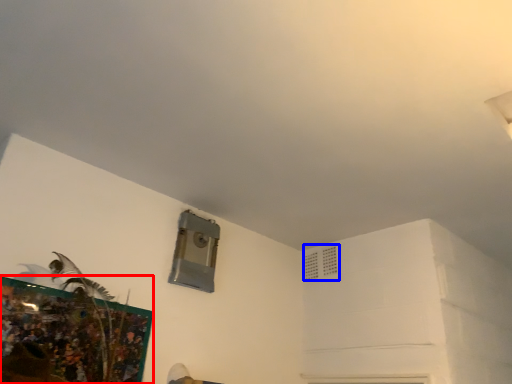
Question: Which of the following is the closest to the observer, picture frame (highlighted by a red box) or air conditioning (highlighted by a blue box)?

Choices:
 (A) picture frame
 (B) air conditioning

Answer: (A)